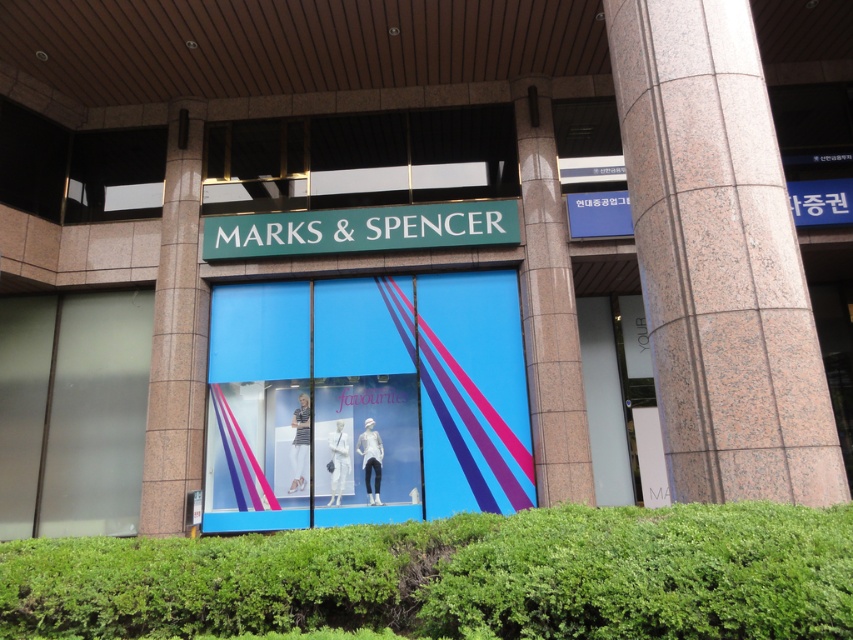
Question: Does green leafy hedge at lower center lie behind granite column at right?

Choices:
 (A) yes
 (B) no

Answer: (B)

Question: Which object is closer to the camera taking this photo?

Choices:
 (A) green leafy hedge at lower center
 (B) transparent glass door at right
 (C) blue glass shop window at center
 (D) granite column at right

Answer: (A)

Question: Which point is farther to the camera?

Choices:
 (A) transparent glass door at right
 (B) blue glass shop window at center
 (C) green matte sign at center

Answer: (A)

Question: Can you confirm if green leafy hedge at lower center is thinner than green matte sign at center?

Choices:
 (A) no
 (B) yes

Answer: (A)

Question: Does granite column at right appear on the left side of blue glass shop window at center?

Choices:
 (A) yes
 (B) no

Answer: (B)

Question: Estimate the real-world distances between objects in this image. Which object is closer to the transparent glass door at right?

Choices:
 (A) blue glass shop window at center
 (B) granite column at right
 (C) green matte sign at center
 (D) green leafy hedge at lower center

Answer: (A)